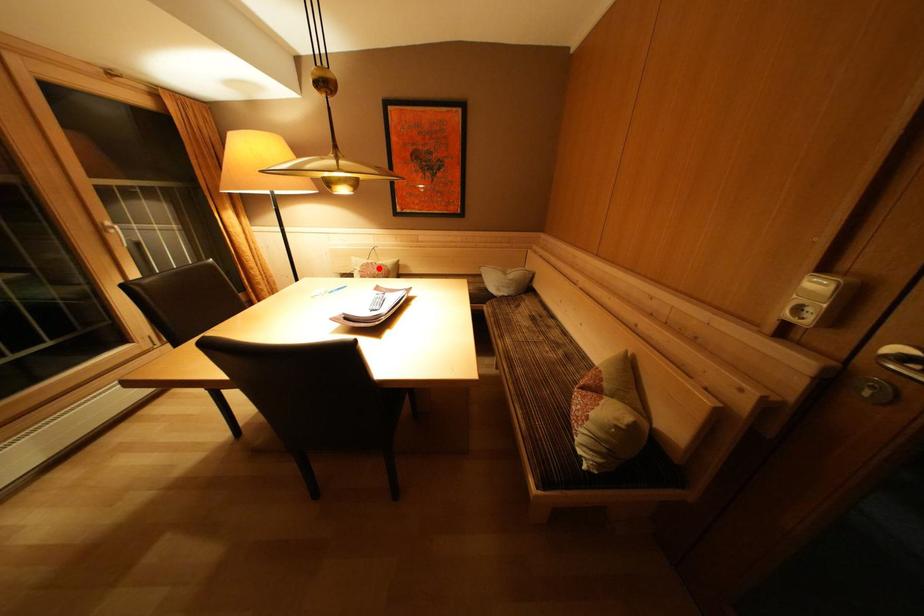
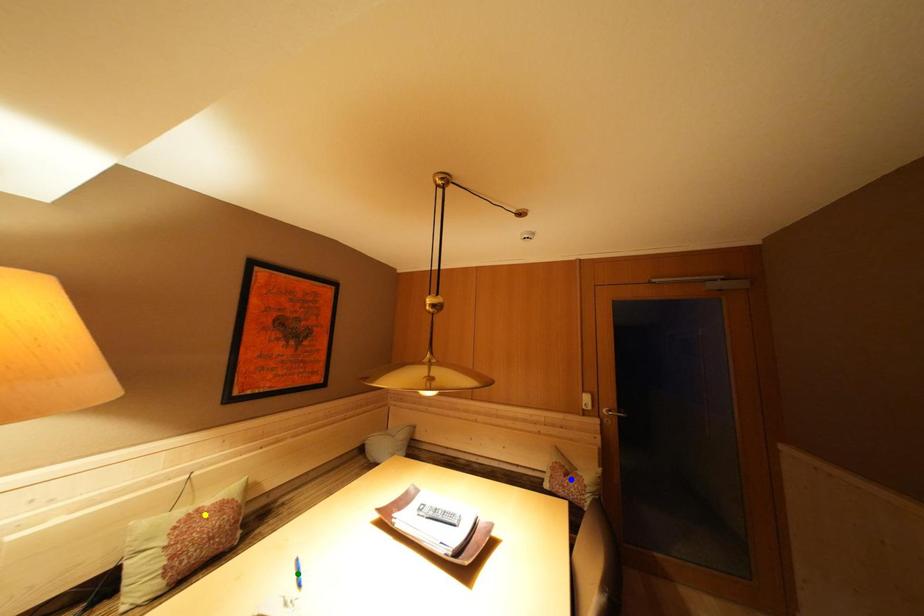
Question: I am providing you with two images of the same scene from different viewpoints. A red point is marked on the first image. You are given multiple points on the second image. In image 2, which mark is for the same physical point as the one in image 1?

Choices:
 (A) green point
 (B) blue point
 (C) yellow point

Answer: (C)